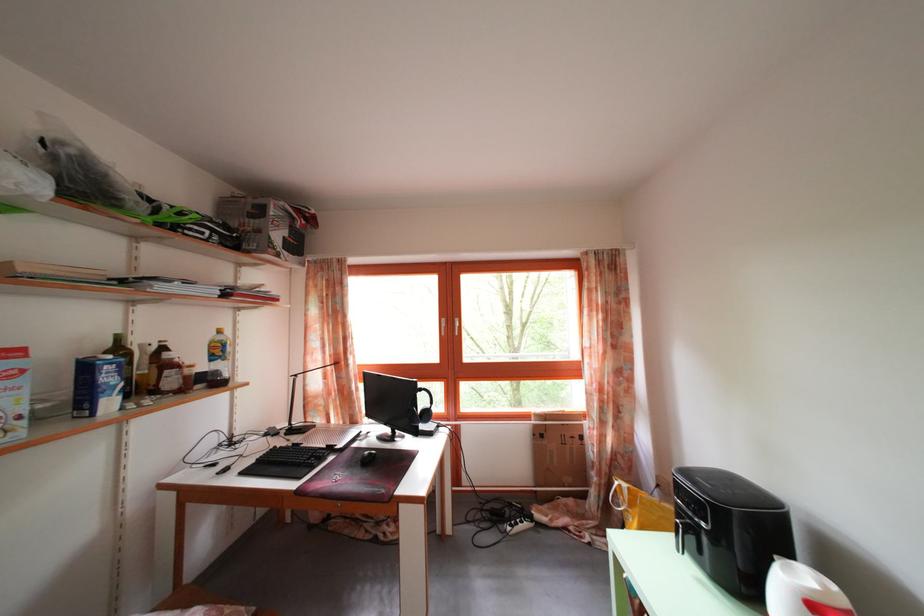
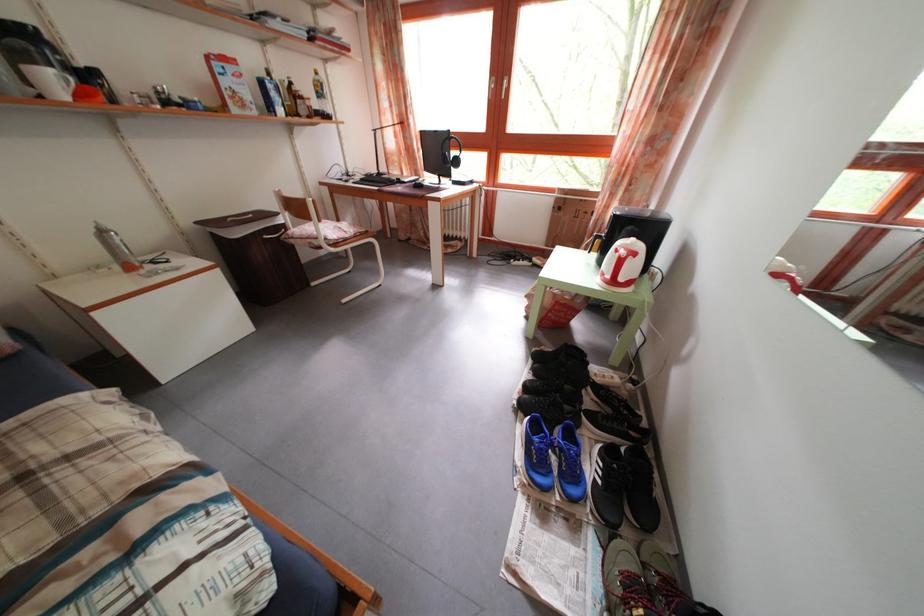
The images are taken continuously from a first-person perspective. In which direction is your viewpoint rotating?

The rotation direction of the camera is left-down.